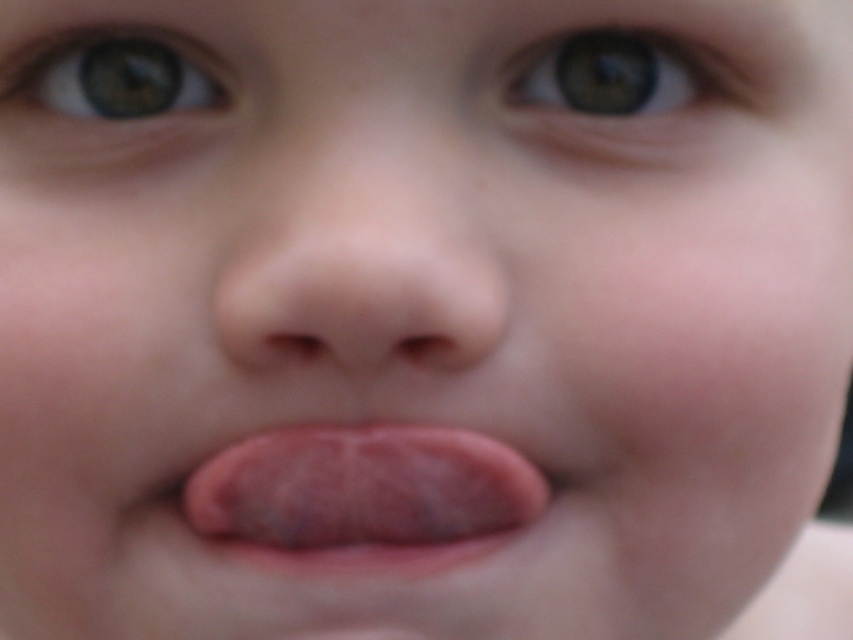
Who is positioned more to the right, smooth flesh-colored nose at center or pink flesh-colored tongue at center?

From the viewer's perspective, pink flesh-colored tongue at center appears more on the right side.

Who is more forward, (254, 273) or (331, 445)?

Point (254, 273) is in front.

In order to click on smooth flesh-colored nose at center in this screenshot , I will do `click(358, 259)`.

Is pink flesh-colored tongue at center wider than green matte eye at upper left?

Yes.

The width and height of the screenshot is (853, 640). Identify the location of pink flesh-colored tongue at center. (363, 497).

Is point (428, 568) positioned after point (155, 108)?

No, (428, 568) is closer to viewer.

Locate an element on the screen. pink flesh-colored tongue at center is located at coordinates (363, 497).

This screenshot has width=853, height=640. In order to click on smooth flesh-colored nose at center in this screenshot , I will do `click(358, 259)`.

Does smooth flesh-colored nose at center have a lesser width compared to green matte eye at upper left?

No, smooth flesh-colored nose at center is not thinner than green matte eye at upper left.

Between point (343, 348) and point (204, 65), which one is positioned behind?

The point (204, 65) is behind.

Where is `smooth flesh-colored nose at center`? This screenshot has width=853, height=640. smooth flesh-colored nose at center is located at coordinates (358, 259).